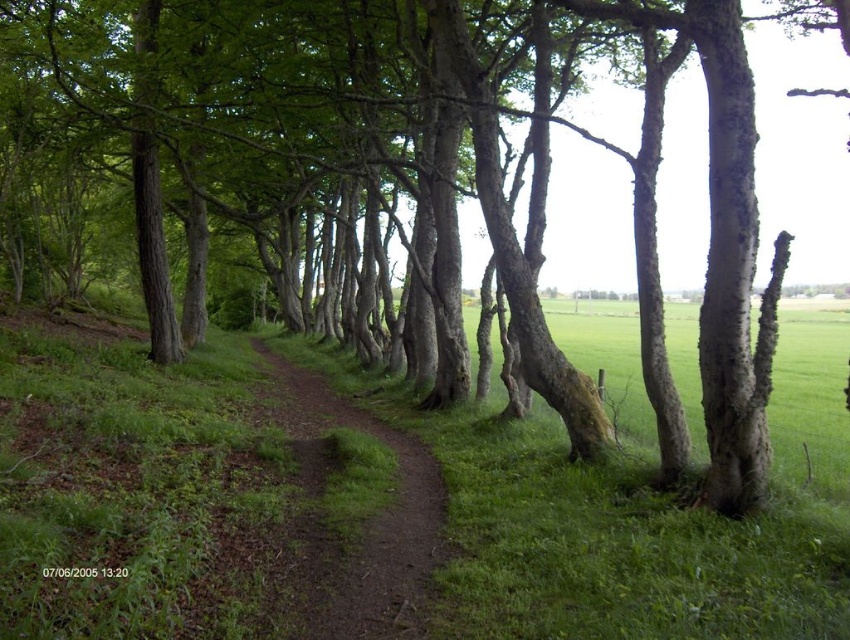
Question: Which point is closer to the camera?

Choices:
 (A) green grassy at center
 (B) brown dirt path at center

Answer: (A)

Question: Is green grassy at center closer to the viewer compared to brown dirt path at center?

Choices:
 (A) yes
 (B) no

Answer: (A)

Question: Which point is farther to the camera?

Choices:
 (A) green grassy at center
 (B) brown dirt path at center

Answer: (B)

Question: Can you confirm if green grassy at center is smaller than brown dirt path at center?

Choices:
 (A) no
 (B) yes

Answer: (A)

Question: Among these objects, which one is farthest from the camera?

Choices:
 (A) green grassy at center
 (B) brown dirt path at center

Answer: (B)

Question: Can you confirm if green grassy at center is bigger than brown dirt path at center?

Choices:
 (A) yes
 (B) no

Answer: (A)